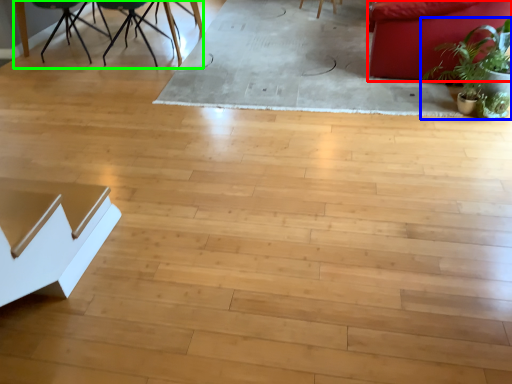
Question: Considering the real-world distances, which object is farthest from couch (highlighted by a red box)? houseplant (highlighted by a blue box) or round table (highlighted by a green box)?

Choices:
 (A) houseplant
 (B) round table

Answer: (B)